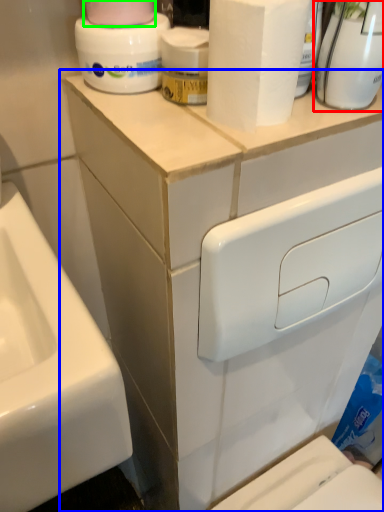
Question: Based on their relative distances, which object is farther from cleaning product (highlighted by a red box)? Choose from bathroom cabinet (highlighted by a blue box) and toilet paper (highlighted by a green box).

Choices:
 (A) bathroom cabinet
 (B) toilet paper

Answer: (A)